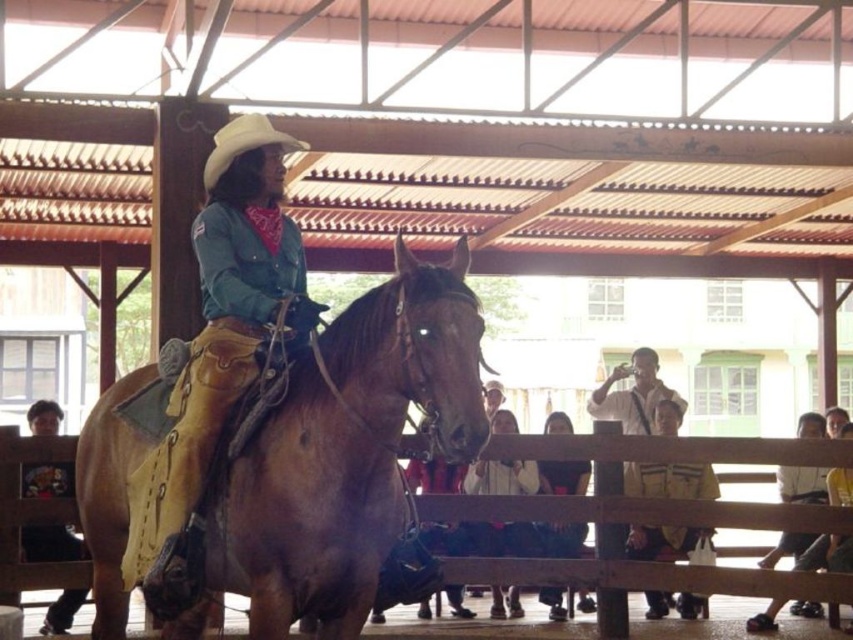
Question: In this image, where is matte brown leather cowboy hat at upper center located relative to matte brown leather jacket at lower left?

Choices:
 (A) right
 (B) left

Answer: (A)

Question: Which of these objects is positioned farthest from the matte black jacket at center?

Choices:
 (A) matte brown leather cowboy hat at upper center
 (B) white cotton shirt at center
 (C) matte brown leather jacket at lower left
 (D) wooden fence at lower center

Answer: (A)

Question: Estimate the real-world distances between objects in this image. Which object is closer to the wooden fence at lower center?

Choices:
 (A) matte black jacket at center
 (B) matte brown leather jacket at lower left
 (C) brown leather horse at center
 (D) white cotton shirt at center

Answer: (D)

Question: Is white cotton shirt at center to the left of matte black jacket at center from the viewer's perspective?

Choices:
 (A) no
 (B) yes

Answer: (B)

Question: Which object is positioned farthest from the brown leather horse at center?

Choices:
 (A) matte brown leather cowboy hat at upper center
 (B) white cotton shirt at center

Answer: (B)

Question: Where is brown leather horse at center located in relation to matte black jacket at center in the image?

Choices:
 (A) above
 (B) below

Answer: (A)